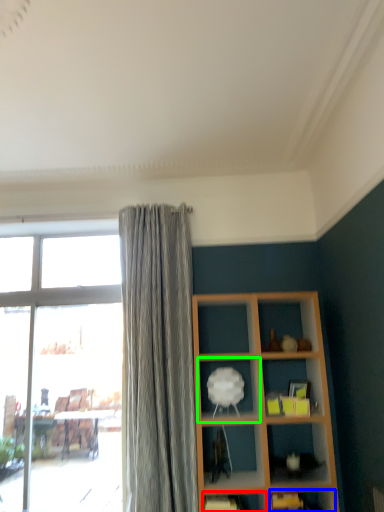
Question: Which is nearer to the shelf (highlighted by a red box)? shelf (highlighted by a blue box) or shelf (highlighted by a green box).

Choices:
 (A) shelf
 (B) shelf

Answer: (A)